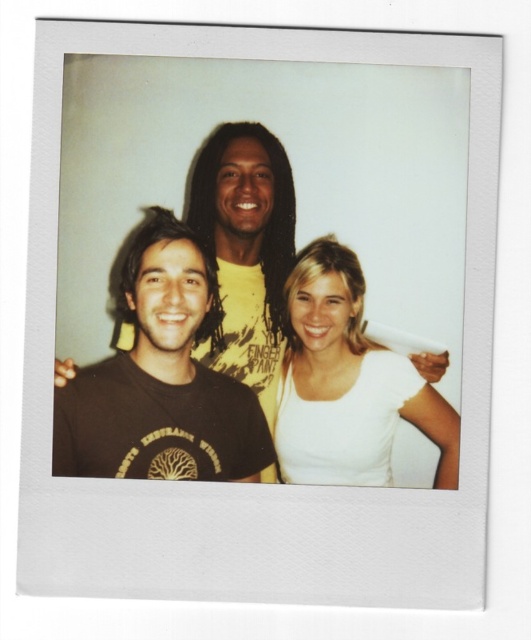
In the scene shown: Is white matte shirt at center to the right of black matte t-shirt at center from the viewer's perspective?

Correct, you'll find white matte shirt at center to the right of black matte t-shirt at center.

Looking at this image, can you confirm if white matte shirt at center is positioned to the left of black matte t-shirt at center?

In fact, white matte shirt at center is to the right of black matte t-shirt at center.

This screenshot has width=531, height=640. I want to click on white matte shirt at center, so click(346, 381).

This screenshot has width=531, height=640. What are the coordinates of `white matte shirt at center` in the screenshot? It's located at (346, 381).